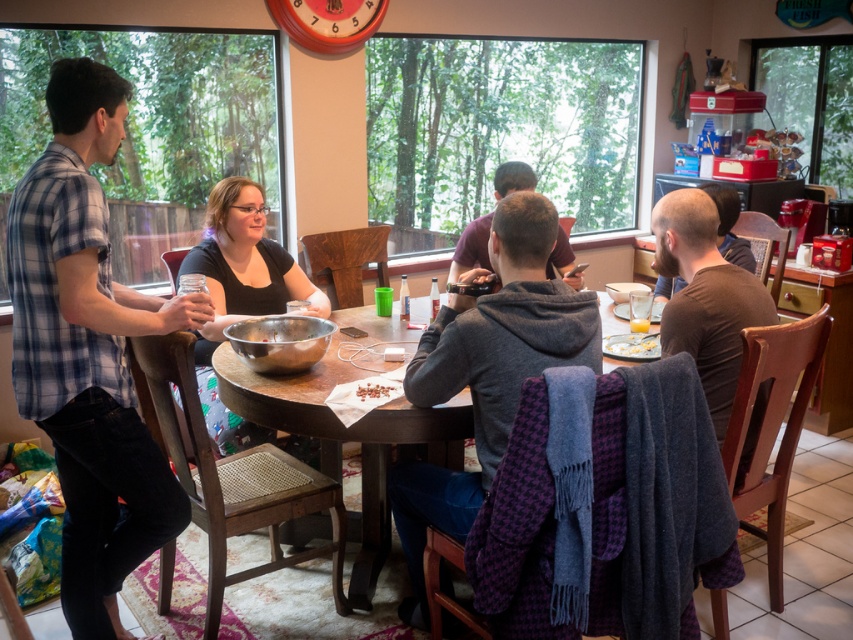
You are planning to buy a new shirt and want to know the size difference between the plaid cotton shirt at left and the brown matte shirt at right. Which one is larger?

The plaid cotton shirt at left is bigger than the brown matte shirt at right.

You are organizing a small event and need to place a decorative item on the table. The metallic bowl at center is currently there. If you want to replace it with a larger item, would the brown matte shirt at right be a suitable replacement?

The brown matte shirt at right is larger in size than the metallic bowl at center, so it would be a suitable replacement as it can occupy the space where the metallic bowl at center was placed.